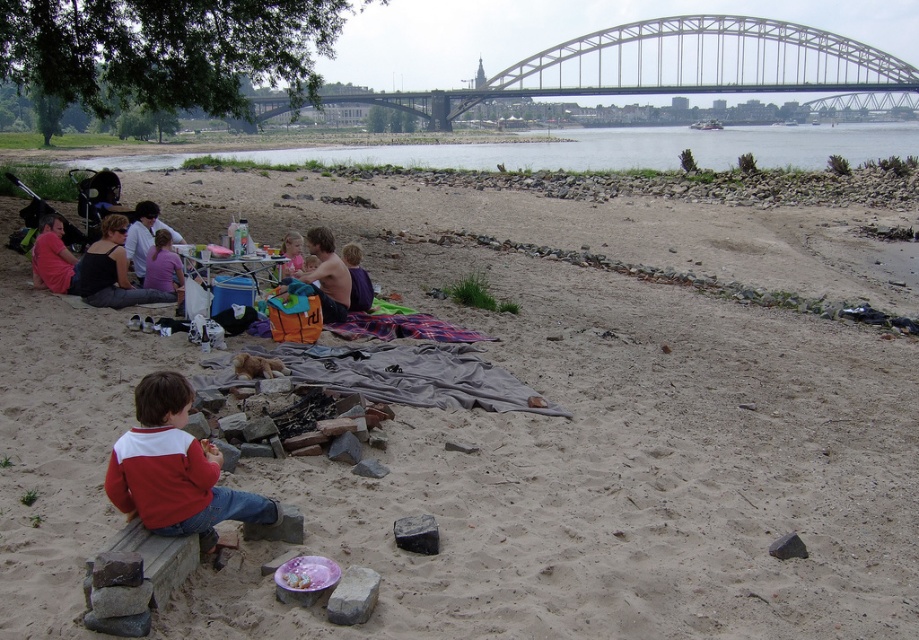
Question: Which point is closer to the camera?

Choices:
 (A) metallic gray bridge at upper center
 (B) matte black tank top at left
 (C) shiny orange bag at center

Answer: (C)

Question: Which is nearer to the shiny orange bag at center?

Choices:
 (A) matte red shirt at left
 (B) pastel pink fabric at center
 (C) metallic gray bridge at upper center
 (D) matte white shirt at center

Answer: (B)

Question: From the image, what is the correct spatial relationship of sandy at left in relation to matte white shirt at center?

Choices:
 (A) above
 (B) below

Answer: (B)

Question: Is sandy at left thinner than shiny orange bag at center?

Choices:
 (A) no
 (B) yes

Answer: (A)

Question: Considering the relative positions of metallic gray bridge at upper center and shiny orange bag at center in the image provided, where is metallic gray bridge at upper center located with respect to shiny orange bag at center?

Choices:
 (A) right
 (B) left

Answer: (A)

Question: Which point is closer to the camera?

Choices:
 (A) pastel pink fabric at center
 (B) metallic gray bridge at upper center
 (C) matte white shirt at center
 (D) sandy at left

Answer: (D)